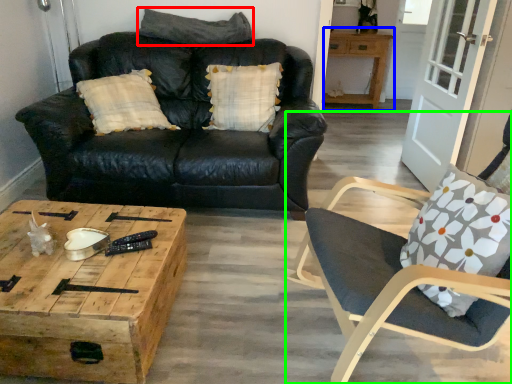
Question: Considering the real-world distances, which object is closest to pillow (highlighted by a red box)? table (highlighted by a blue box) or chair (highlighted by a green box).

Choices:
 (A) table
 (B) chair

Answer: (B)